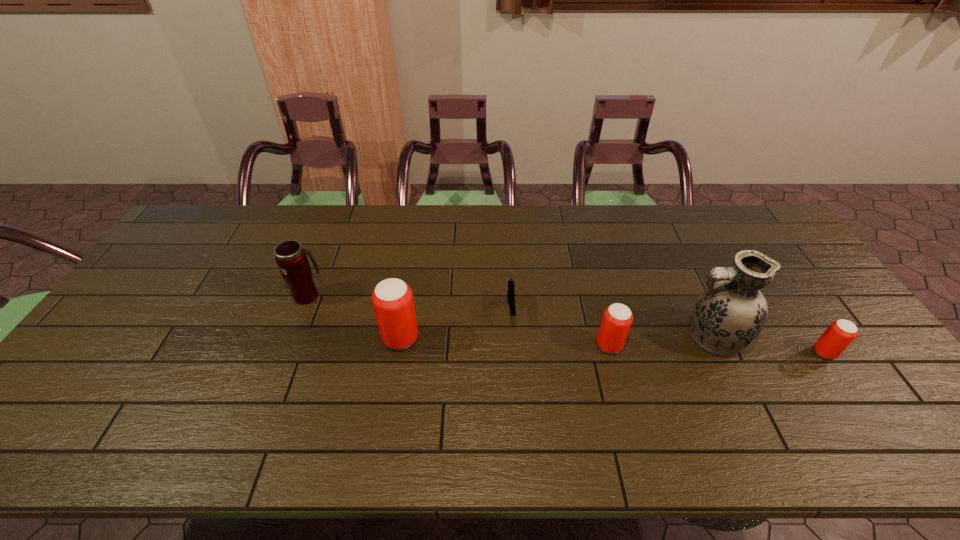
Find the location of a particular element. The image size is (960, 540). free space between the shortest beer can and the shortest object is located at coordinates (667, 332).

The width and height of the screenshot is (960, 540). In order to click on empty space that is in between the second object from right to left and the second shortest beer can in this screenshot , I will do `click(660, 341)`.

The width and height of the screenshot is (960, 540). I want to click on empty space that is in between the leftmost object and the fifth object from right to left, so click(354, 316).

Locate an element on the screen. The image size is (960, 540). free area in between the tallest object and the rightmost beer can is located at coordinates (768, 345).

Where is `free spot between the tallest object and the fourth object from left to right`? The height and width of the screenshot is (540, 960). free spot between the tallest object and the fourth object from left to right is located at coordinates (660, 341).

At what (x,y) coordinates should I click in order to perform the action: click on free space that is in between the rightmost beer can and the fourth object from right to left. Please return your answer as a coordinate pair (x, y). This screenshot has height=540, width=960. Looking at the image, I should click on (667, 332).

Identify which object is located as the second nearest to the pistol. Please provide its 2D coordinates. Your answer should be formatted as a tuple, i.e. [(x, y)], where the tuple contains the x and y coordinates of a point satisfying the conditions above.

[(392, 298)]

Find the location of a particular element. object that stands as the closest to the fifth object from right to left is located at coordinates (290, 256).

Image resolution: width=960 pixels, height=540 pixels. I want to click on beer can that is the second closest one to the fifth tallest object, so click(x=392, y=298).

Locate which beer can ranks second in proximity to the second object from left to right. Please provide its 2D coordinates. Your answer should be formatted as a tuple, i.e. [(x, y)], where the tuple contains the x and y coordinates of a point satisfying the conditions above.

[(836, 338)]